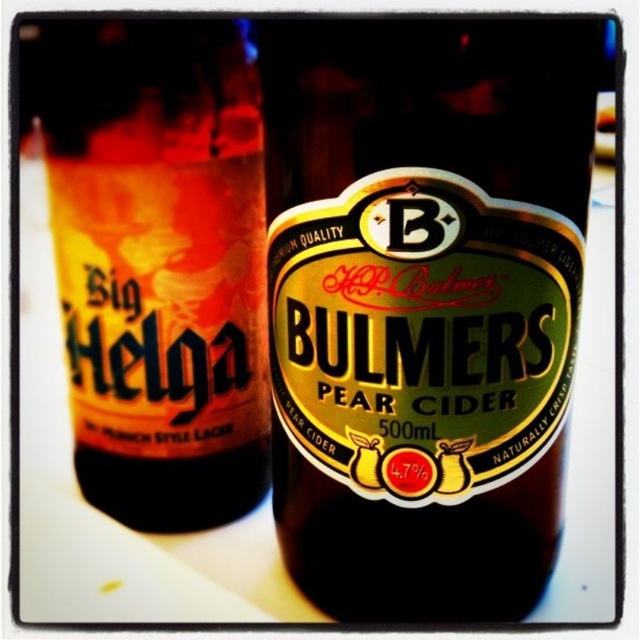
Question: Which point is farther to the camera?

Choices:
 (A) (380, 522)
 (B) (116, 465)

Answer: (B)

Question: Can you confirm if green glass bottle at center is positioned above matte glass bottle at left?

Choices:
 (A) yes
 (B) no

Answer: (B)

Question: Observing the image, what is the correct spatial positioning of green glass bottle at center in reference to matte glass bottle at left?

Choices:
 (A) above
 (B) below

Answer: (B)

Question: Which point is farther from the camera taking this photo?

Choices:
 (A) (196, 324)
 (B) (464, 282)

Answer: (A)

Question: Which of the following is the closest to the observer?

Choices:
 (A) (353, 234)
 (B) (205, 420)

Answer: (A)

Question: Can you confirm if green glass bottle at center is positioned to the left of matte glass bottle at left?

Choices:
 (A) yes
 (B) no

Answer: (B)